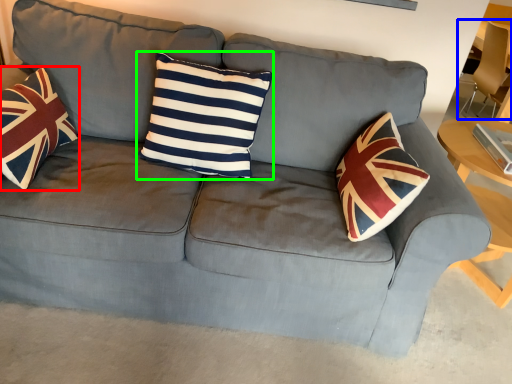
Question: Which object is positioned farthest from throw pillow (highlighted by a red box)? Select from armchair (highlighted by a blue box) and pillow (highlighted by a green box).

Choices:
 (A) armchair
 (B) pillow

Answer: (A)